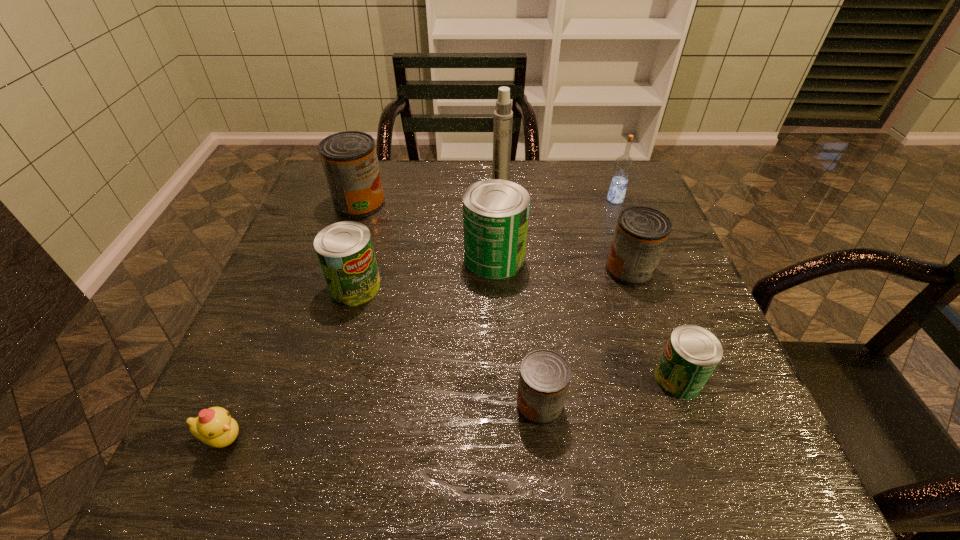
Locate an element on the screen. The height and width of the screenshot is (540, 960). vacant space situated 0.170m on the left of the nearest green can is located at coordinates (564, 379).

This screenshot has height=540, width=960. In order to click on vacant space located on the right of the nearest red can in this screenshot , I will do `click(663, 404)`.

This screenshot has height=540, width=960. Identify the location of free space located 0.290m on the front-facing side of the yellow duckling. (420, 438).

This screenshot has width=960, height=540. Identify the location of aerosol can that is at the far edge. (503, 115).

The height and width of the screenshot is (540, 960). In order to click on vodka located in the far edge section of the desktop in this screenshot , I will do `click(623, 166)`.

You are a GUI agent. You are given a task and a screenshot of the screen. Output one action in this format:
    pyautogui.click(x=<x>, y=<y>)
    Task: Click on the can that is at the far edge
    The width and height of the screenshot is (960, 540).
    Given the screenshot: What is the action you would take?
    pyautogui.click(x=349, y=158)

Identify the location of object positioned at the near edge. (214, 426).

Identify the location of duckling positioned at the left edge. The height and width of the screenshot is (540, 960). (214, 426).

Identify the location of vodka present at the right edge. (623, 166).

I want to click on object present at the far left corner, so click(x=349, y=158).